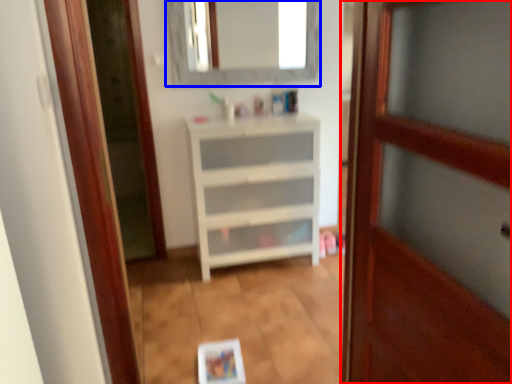
Question: Which object is further to the camera taking this photo, door (highlighted by a red box) or mirror (highlighted by a blue box)?

Choices:
 (A) door
 (B) mirror

Answer: (B)